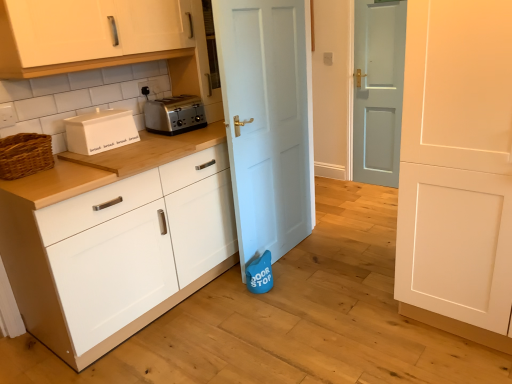
The height and width of the screenshot is (384, 512). In order to click on free space in front of light blue wooden door at center, acting as the first door starting from the back in this screenshot , I will do `click(377, 190)`.